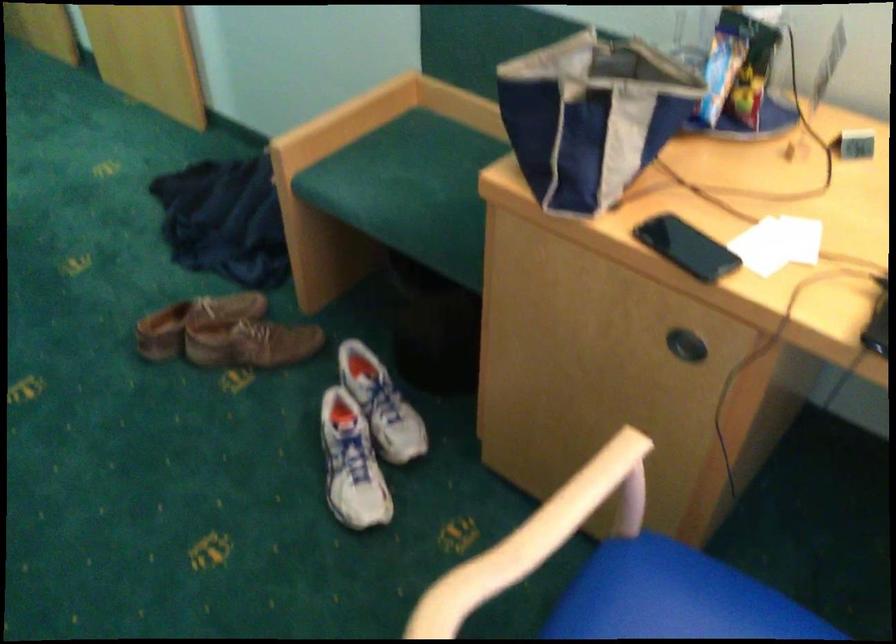
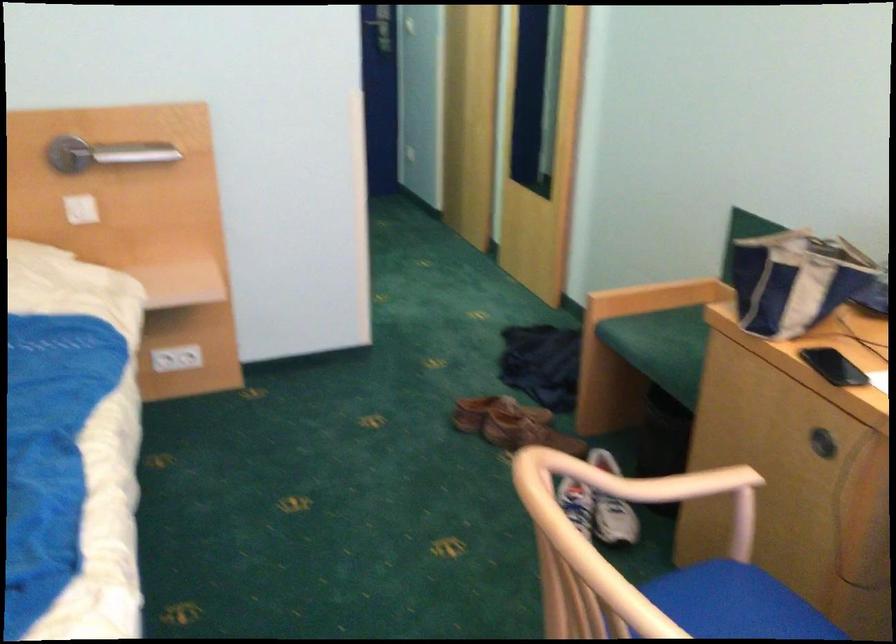
The point at (x=398, y=457) is marked in the first image. Where is the corresponding point in the second image?

(607, 543)